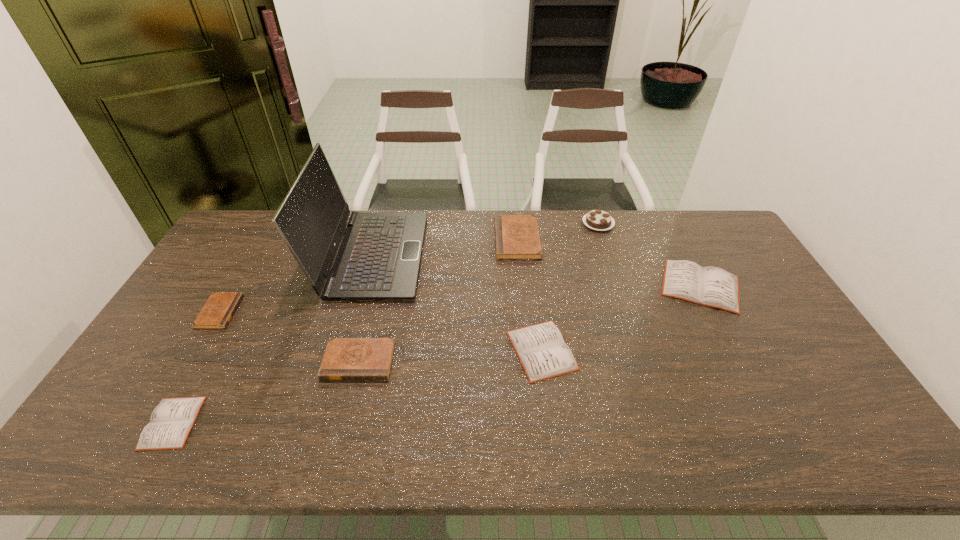
Locate an element on the screen. The height and width of the screenshot is (540, 960). the closest brown diary relative to the second brown diary from left to right is located at coordinates pos(219,309).

Locate which brown diary is the second closest to the second brown diary from left to right. Please provide its 2D coordinates. Your answer should be formatted as a tuple, i.e. [(x, y)], where the tuple contains the x and y coordinates of a point satisfying the conditions above.

[(517, 237)]

Identify which white diary is the third nearest to the biggest brown diary. Please provide its 2D coordinates. Your answer should be formatted as a tuple, i.e. [(x, y)], where the tuple contains the x and y coordinates of a point satisfying the conditions above.

[(171, 421)]

Locate which white diary ranks in proximity to the black laptop computer. Please provide its 2D coordinates. Your answer should be formatted as a tuple, i.e. [(x, y)], where the tuple contains the x and y coordinates of a point satisfying the conditions above.

[(541, 349)]

Locate an element on the screen. free spot that satisfies the following two spatial constraints: 1. on the screen of the black laptop computer; 2. on the back side of the biggest white diary is located at coordinates (363, 286).

Identify the location of free space that satisfies the following two spatial constraints: 1. on the spine side of the biggest white diary; 2. on the right side of the tallest diary. (521, 286).

Identify the location of blank area in the image that satisfies the following two spatial constraints: 1. on the screen of the second smallest white diary; 2. on the left side of the laptop computer. The image size is (960, 540). (346, 350).

At what (x,y) coordinates should I click in order to perform the action: click on vacant position in the image that satisfies the following two spatial constraints: 1. on the back side of the rightmost white diary; 2. on the left side of the second nearest white diary. Please return your answer as a coordinate pair (x, y). Image resolution: width=960 pixels, height=540 pixels. Looking at the image, I should click on (534, 286).

The height and width of the screenshot is (540, 960). Identify the location of free space that satisfies the following two spatial constraints: 1. on the back side of the farthest white diary; 2. on the screen of the laptop computer. (684, 255).

I want to click on free space that satisfies the following two spatial constraints: 1. on the screen of the laptop computer; 2. on the back side of the second farthest white diary, so click(x=346, y=350).